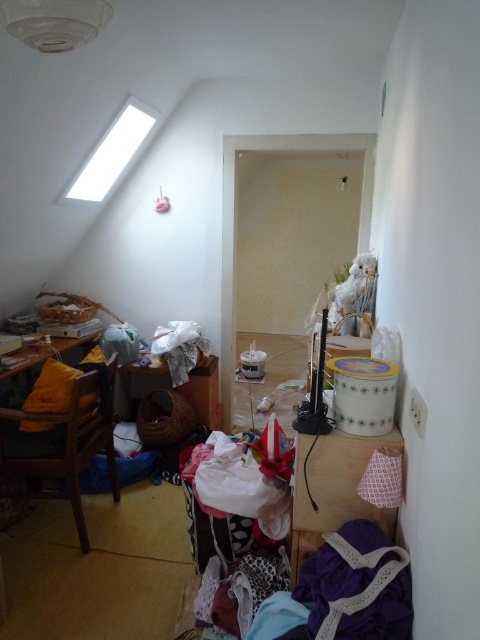
Question: Which point appears farthest from the camera in this image?

Choices:
 (A) (400, 604)
 (B) (122, 388)
 (C) (85, 344)

Answer: (C)

Question: Which point is farther from the camera taking this photo?

Choices:
 (A) (55, 342)
 (B) (160, 369)

Answer: (B)

Question: Is purple lace fabric at lower right to the right of wooden table at center from the viewer's perspective?

Choices:
 (A) yes
 (B) no

Answer: (A)

Question: Where is purple lace fabric at lower right located in relation to wooden table at center in the image?

Choices:
 (A) right
 (B) left

Answer: (A)

Question: Can you confirm if wooden table at center is wider than yellow fabric-covered table at left?

Choices:
 (A) no
 (B) yes

Answer: (B)

Question: Estimate the real-world distances between objects in this image. Which object is closer to the yellow fabric-covered table at left?

Choices:
 (A) purple lace fabric at lower right
 (B) wooden table at center

Answer: (B)